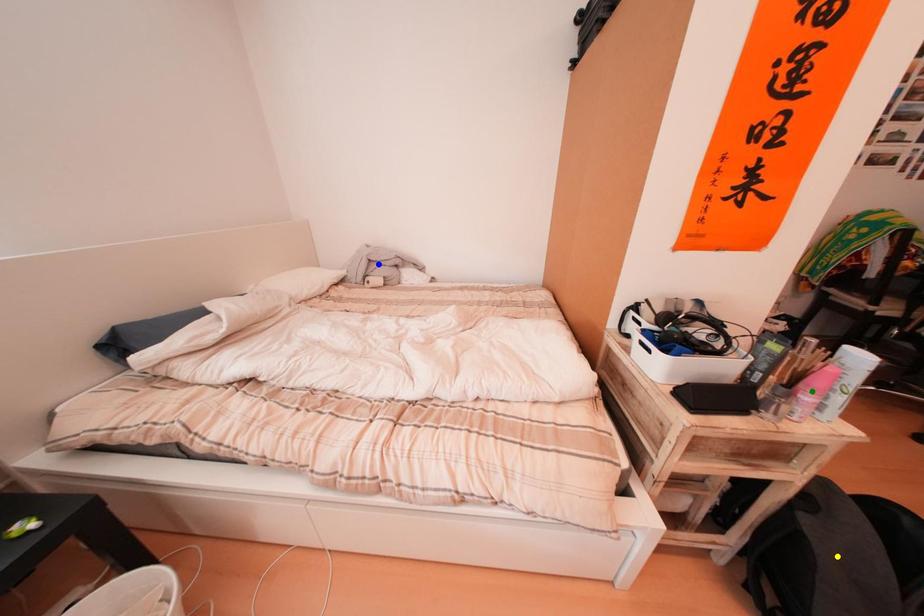
Order these from farthest to nearest:
- green point
- blue point
- yellow point

blue point → yellow point → green point